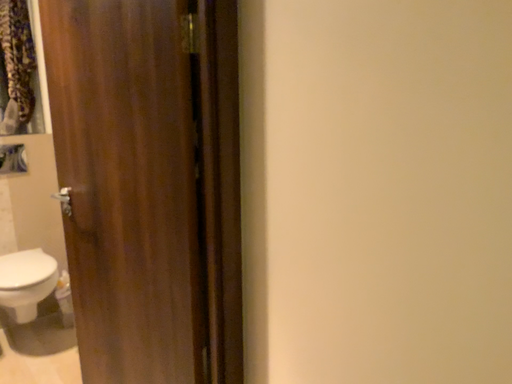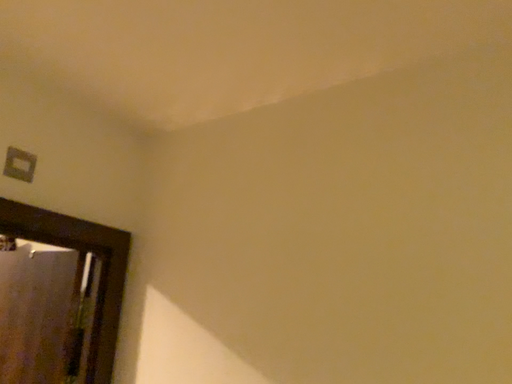
Question: Which way did the camera rotate in the video?

Choices:
 (A) rotated right
 (B) rotated left

Answer: (A)